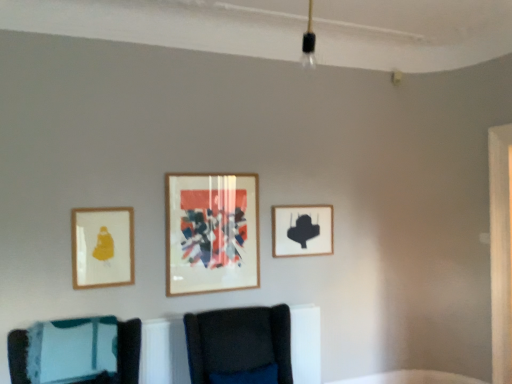
At what (x,y) coordinates should I click in order to perform the action: click on matte gold picture frame at left, the first picture frame positioned from the left. Please return your answer as a coordinate pair (x, y). This screenshot has width=512, height=384. Looking at the image, I should click on (102, 247).

At what (x,y) coordinates should I click in order to perform the action: click on matte gold picture frame at left, arranged as the 1th picture frame when viewed from the front. Please return your answer as a coordinate pair (x, y). The width and height of the screenshot is (512, 384). Looking at the image, I should click on (102, 247).

How many degrees apart are the facing directions of matte gold picture frame at left, the first picture frame positioned from the left, and wooden-framed artwork at center, marked as the second picture frame in a front-to-back arrangement?

0.000533 degrees.

Is matte gold picture frame at left, the first picture frame positioned from the left, shorter than wooden-framed artwork at center, positioned as the second picture frame in back-to-front order?

Indeed, matte gold picture frame at left, the first picture frame positioned from the left, has a lesser height compared to wooden-framed artwork at center, positioned as the second picture frame in back-to-front order.

From the image's perspective, is matte gold picture frame at left, marked as the 3th picture frame in a right-to-left arrangement, below wooden-framed artwork at center, positioned as the 2th picture frame in right-to-left order?

Correct, matte gold picture frame at left, marked as the 3th picture frame in a right-to-left arrangement, appears lower than wooden-framed artwork at center, positioned as the 2th picture frame in right-to-left order, in the image.

Could you measure the distance between matte gold picture frame at left, the 3th picture frame in the back-to-front sequence, and wooden-framed artwork at center, marked as the second picture frame in a front-to-back arrangement?

52.05 centimeters.

I want to click on the 2nd picture frame above when counting from the matte gold picture frame at left, the first picture frame positioned from the left (from the image's perspective), so click(211, 233).

Is wooden-framed artwork at center, positioned as the second picture frame in back-to-front order, facing towards matte gold picture frame at left, arranged as the 1th picture frame when viewed from the front?

No.

From a real-world perspective, is wooden-framed artwork at center, positioned as the second picture frame in back-to-front order, over matte gold picture frame at left, the first picture frame positioned from the left?

Correct, in the physical world, wooden-framed artwork at center, positioned as the second picture frame in back-to-front order, is higher than matte gold picture frame at left, the first picture frame positioned from the left.

Would you say matte gold picture frame at left, arranged as the 1th picture frame when viewed from the front, is part of teal fabric cushion at lower left, arranged as the 1th furniture when viewed from the left,'s contents?

No, matte gold picture frame at left, arranged as the 1th picture frame when viewed from the front, is located outside of teal fabric cushion at lower left, arranged as the 1th furniture when viewed from the left.

Which of these two, teal fabric cushion at lower left, arranged as the 1th furniture when viewed from the left, or matte gold picture frame at left, arranged as the 1th picture frame when viewed from the front, stands taller?

matte gold picture frame at left, arranged as the 1th picture frame when viewed from the front.

From a real-world perspective, between teal fabric cushion at lower left, which is counted as the second furniture, starting from the right, and matte gold picture frame at left, marked as the 3th picture frame in a right-to-left arrangement, who is vertically higher?

In real-world perspective, matte gold picture frame at left, marked as the 3th picture frame in a right-to-left arrangement, is above.

Is teal fabric cushion at lower left, arranged as the 1th furniture when viewed from the left, positioned with its back to matte gold picture frame at left, the first picture frame positioned from the left?

No, teal fabric cushion at lower left, arranged as the 1th furniture when viewed from the left, is not facing the opposite direction of matte gold picture frame at left, the first picture frame positioned from the left.

From the picture: From the image's perspective, is velvet dark blue chair at center, arranged as the 1th furniture when viewed from the right, positioned above or below matte gold picture frame at left, marked as the 3th picture frame in a right-to-left arrangement?

velvet dark blue chair at center, arranged as the 1th furniture when viewed from the right, is situated lower than matte gold picture frame at left, marked as the 3th picture frame in a right-to-left arrangement, in the image.

Between point (250, 354) and point (114, 268), which one is positioned in front?

The point (250, 354) is closer.

There is a matte gold picture frame at left, the first picture frame positioned from the left. Identify the location of the 2nd furniture below it (from a real-world perspective). (240, 346).

Considering the points (247, 229) and (306, 223), which point is in front, point (247, 229) or point (306, 223)?

The point (247, 229) is closer.

Does wooden-framed artwork at center, arranged as the 2th picture frame when viewed from the left, appear on the right side of black matte picture frame at upper right, which is the 1th picture frame from back to front?

Incorrect, wooden-framed artwork at center, arranged as the 2th picture frame when viewed from the left, is not on the right side of black matte picture frame at upper right, which is the 1th picture frame from back to front.

Is wooden-framed artwork at center, positioned as the 2th picture frame in right-to-left order, far away from black matte picture frame at upper right, arranged as the first picture frame when viewed from the right?

Actually, wooden-framed artwork at center, positioned as the 2th picture frame in right-to-left order, and black matte picture frame at upper right, arranged as the first picture frame when viewed from the right, are a little close together.

Is wooden-framed artwork at center, positioned as the 2th picture frame in right-to-left order, positioned behind black matte picture frame at upper right, acting as the third picture frame starting from the front?

No, it is in front of black matte picture frame at upper right, acting as the third picture frame starting from the front.

Is point (170, 205) more distant than point (125, 379)?

Yes.

From a real-world perspective, is wooden-framed artwork at center, positioned as the second picture frame in back-to-front order, on top of teal fabric cushion at lower left, arranged as the 1th furniture when viewed from the left?

Yes, from a real-world perspective, wooden-framed artwork at center, positioned as the second picture frame in back-to-front order, is on top of teal fabric cushion at lower left, arranged as the 1th furniture when viewed from the left.

Does wooden-framed artwork at center, positioned as the second picture frame in back-to-front order, turn towards teal fabric cushion at lower left, which is counted as the second furniture, starting from the right?

No.

Does wooden-framed artwork at center, positioned as the second picture frame in back-to-front order, contain teal fabric cushion at lower left, which is counted as the second furniture, starting from the right?

No, teal fabric cushion at lower left, which is counted as the second furniture, starting from the right, is not a part of wooden-framed artwork at center, positioned as the second picture frame in back-to-front order.

Which of these two, black matte picture frame at upper right, acting as the third picture frame starting from the front, or matte gold picture frame at left, arranged as the 1th picture frame when viewed from the front, stands taller?

With more height is matte gold picture frame at left, arranged as the 1th picture frame when viewed from the front.

Is point (301, 225) positioned behind point (72, 218)?

Yes.

Which of these two, black matte picture frame at upper right, arranged as the first picture frame when viewed from the right, or matte gold picture frame at left, arranged as the 1th picture frame when viewed from the front, is thinner?

Thinner between the two is matte gold picture frame at left, arranged as the 1th picture frame when viewed from the front.

From a real-world perspective, is black matte picture frame at upper right, the 3th picture frame from the left, beneath matte gold picture frame at left, the 3th picture frame in the back-to-front sequence?

No, from a real-world perspective, black matte picture frame at upper right, the 3th picture frame from the left, is not beneath matte gold picture frame at left, the 3th picture frame in the back-to-front sequence.

Find the location of `the 1st picture frame behind the matte gold picture frame at left, marked as the 3th picture frame in a right-to-left arrangement`. the 1st picture frame behind the matte gold picture frame at left, marked as the 3th picture frame in a right-to-left arrangement is located at coordinates (211, 233).

You are a GUI agent. You are given a task and a screenshot of the screen. Output one action in this format:
    pyautogui.click(x=<x>, y=<y>)
    Task: Click on the picture frame in front of the wooden-framed artwork at center, marked as the second picture frame in a front-to-back arrangement
    The image size is (512, 384).
    Given the screenshot: What is the action you would take?
    pyautogui.click(x=102, y=247)

Estimate the real-world distances between objects in this image. Which object is further from black matte picture frame at upper right, arranged as the first picture frame when viewed from the right, teal fabric cushion at lower left, arranged as the 1th furniture when viewed from the left, or wooden-framed artwork at center, positioned as the 2th picture frame in right-to-left order?

teal fabric cushion at lower left, arranged as the 1th furniture when viewed from the left.

From the image, which object appears to be nearer to black matte picture frame at upper right, acting as the third picture frame starting from the front, velvet dark blue chair at center, which appears as the second furniture when viewed from the left, or teal fabric cushion at lower left, which is counted as the second furniture, starting from the right?

The object closer to black matte picture frame at upper right, acting as the third picture frame starting from the front, is velvet dark blue chair at center, which appears as the second furniture when viewed from the left.

Estimate the real-world distances between objects in this image. Which object is closer to teal fabric cushion at lower left, arranged as the 1th furniture when viewed from the left, wooden-framed artwork at center, marked as the second picture frame in a front-to-back arrangement, or velvet dark blue chair at center, arranged as the 1th furniture when viewed from the right?

velvet dark blue chair at center, arranged as the 1th furniture when viewed from the right, is positioned closer to the anchor teal fabric cushion at lower left, arranged as the 1th furniture when viewed from the left.

When comparing their distances from velvet dark blue chair at center, which appears as the second furniture when viewed from the left, does teal fabric cushion at lower left, which is counted as the second furniture, starting from the right, or wooden-framed artwork at center, positioned as the 2th picture frame in right-to-left order, seem closer?

Among the two, wooden-framed artwork at center, positioned as the 2th picture frame in right-to-left order, is located nearer to velvet dark blue chair at center, which appears as the second furniture when viewed from the left.

Which object lies nearer to the anchor point teal fabric cushion at lower left, which is counted as the second furniture, starting from the right, black matte picture frame at upper right, acting as the third picture frame starting from the front, or wooden-framed artwork at center, positioned as the 2th picture frame in right-to-left order?

wooden-framed artwork at center, positioned as the 2th picture frame in right-to-left order, is positioned closer to the anchor teal fabric cushion at lower left, which is counted as the second furniture, starting from the right.

Looking at the image, which one is located further to matte gold picture frame at left, the 3th picture frame in the back-to-front sequence, velvet dark blue chair at center, arranged as the 1th furniture when viewed from the right, or teal fabric cushion at lower left, which is counted as the second furniture, starting from the right?

The object further to matte gold picture frame at left, the 3th picture frame in the back-to-front sequence, is velvet dark blue chair at center, arranged as the 1th furniture when viewed from the right.

Estimate the real-world distances between objects in this image. Which object is further from velvet dark blue chair at center, arranged as the 1th furniture when viewed from the right, black matte picture frame at upper right, acting as the third picture frame starting from the front, or teal fabric cushion at lower left, arranged as the 1th furniture when viewed from the left?

Among the two, black matte picture frame at upper right, acting as the third picture frame starting from the front, is located further to velvet dark blue chair at center, arranged as the 1th furniture when viewed from the right.

Based on their spatial positions, is black matte picture frame at upper right, arranged as the first picture frame when viewed from the right, or teal fabric cushion at lower left, arranged as the 1th furniture when viewed from the left, closer to matte gold picture frame at left, arranged as the 1th picture frame when viewed from the front?

teal fabric cushion at lower left, arranged as the 1th furniture when viewed from the left, is positioned closer to the anchor matte gold picture frame at left, arranged as the 1th picture frame when viewed from the front.

Identify the location of picture frame between teal fabric cushion at lower left, arranged as the 1th furniture when viewed from the left, and wooden-framed artwork at center, marked as the second picture frame in a front-to-back arrangement, in the front-back direction. click(102, 247).

Image resolution: width=512 pixels, height=384 pixels. Find the location of `picture frame located between matte gold picture frame at left, the 3th picture frame in the back-to-front sequence, and black matte picture frame at upper right, arranged as the first picture frame when viewed from the right, in the left-right direction`. picture frame located between matte gold picture frame at left, the 3th picture frame in the back-to-front sequence, and black matte picture frame at upper right, arranged as the first picture frame when viewed from the right, in the left-right direction is located at coordinates (x=211, y=233).

At what (x,y) coordinates should I click in order to perform the action: click on furniture between teal fabric cushion at lower left, which is counted as the second furniture, starting from the right, and black matte picture frame at upper right, the 3th picture frame from the left, from front to back. Please return your answer as a coordinate pair (x, y). Looking at the image, I should click on (240, 346).

Locate an element on the screen. picture frame positioned between velvet dark blue chair at center, arranged as the 1th furniture when viewed from the right, and wooden-framed artwork at center, positioned as the 2th picture frame in right-to-left order, from near to far is located at coordinates (102, 247).